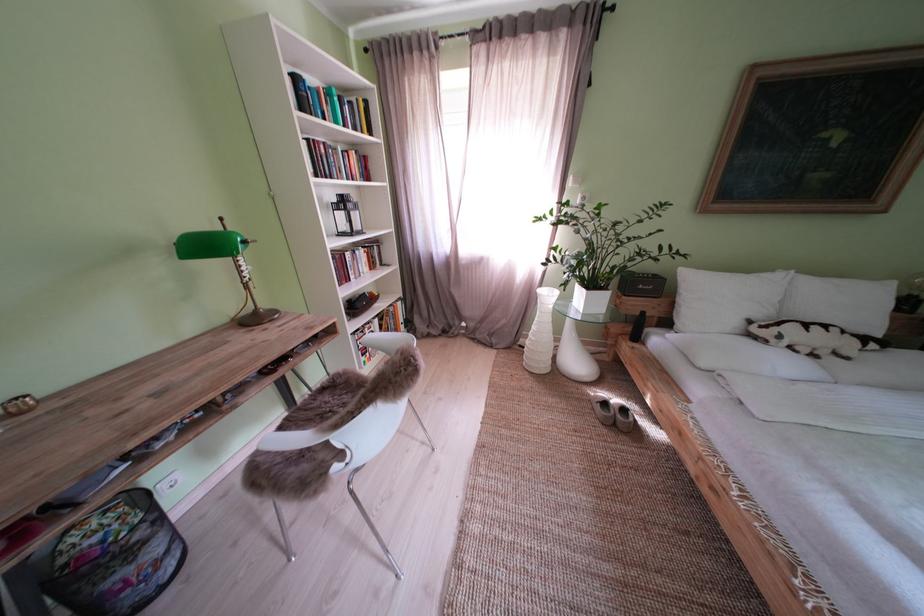
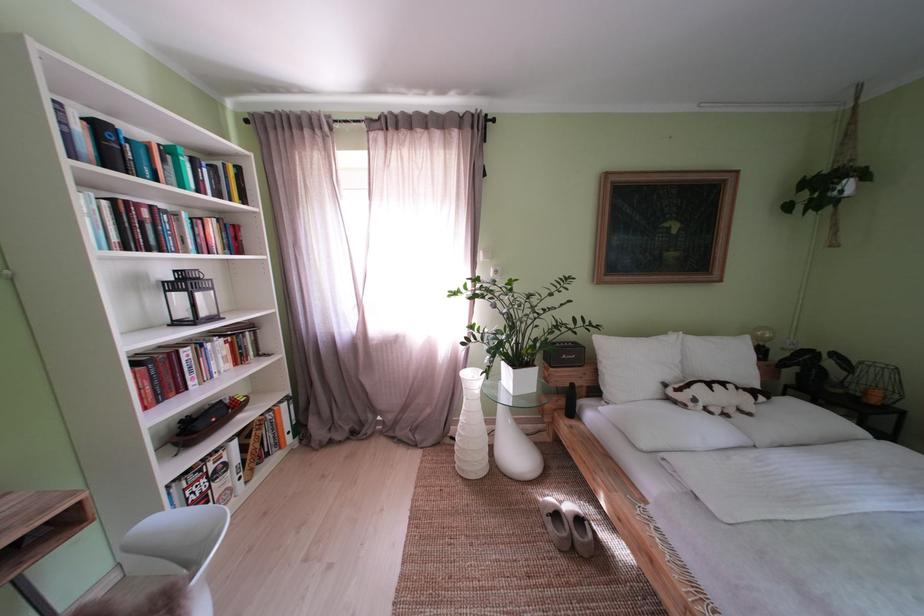
Find the pixel in the second image that matches (354,209) in the first image.

(198, 286)